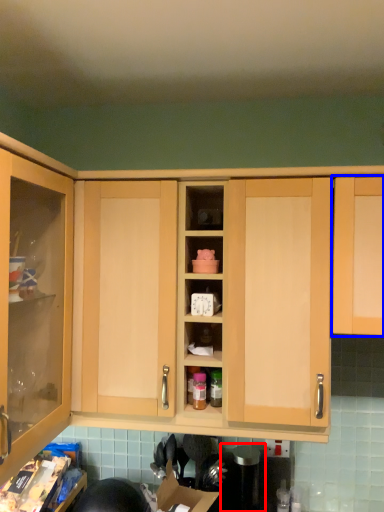
Question: Which object is closer to the camera taking this photo, appliance (highlighted by a red box) or cabinetry (highlighted by a blue box)?

Choices:
 (A) appliance
 (B) cabinetry

Answer: (B)